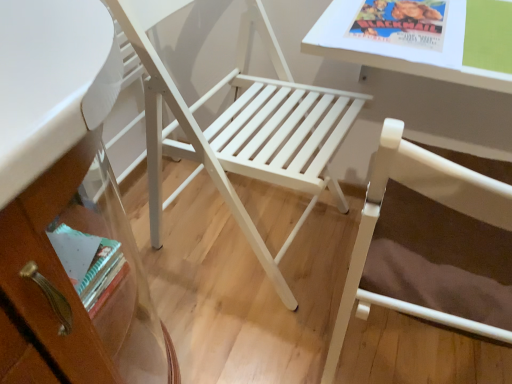
Question: From a real-world perspective, is white wood chair at center, which is the second chair from right to left, positioned under white wood chair at center, which ranks as the 1th chair in right-to-left order, based on gravity?

Choices:
 (A) yes
 (B) no

Answer: (A)

Question: Is white wood chair at center, which is the second chair from right to left, smaller than white wood chair at center, which is counted as the second chair, starting from the left?

Choices:
 (A) yes
 (B) no

Answer: (B)

Question: Is white wood chair at center, which is counted as the second chair, starting from the left, located within white wood chair at center, placed as the first chair when sorted from left to right?

Choices:
 (A) yes
 (B) no

Answer: (B)

Question: Can you confirm if white wood chair at center, placed as the first chair when sorted from left to right, is bigger than white wood chair at center, which ranks as the 1th chair in right-to-left order?

Choices:
 (A) no
 (B) yes

Answer: (B)

Question: Is white wood chair at center, which is the second chair from right to left, oriented away from white wood chair at center, which ranks as the 1th chair in right-to-left order?

Choices:
 (A) yes
 (B) no

Answer: (B)

Question: Considering the positions of point (352, 59) and point (413, 167), is point (352, 59) closer or farther from the camera than point (413, 167)?

Choices:
 (A) farther
 (B) closer

Answer: (A)

Question: Looking at their shapes, would you say white glossy table at upper right is wider or thinner than white wood chair at center, which is counted as the second chair, starting from the left?

Choices:
 (A) thin
 (B) wide

Answer: (A)

Question: In the image, is white glossy table at upper right positioned in front of or behind white wood chair at center, which is counted as the second chair, starting from the left?

Choices:
 (A) behind
 (B) front

Answer: (A)

Question: Is white glossy table at upper right taller or shorter than white wood chair at center, which ranks as the 1th chair in right-to-left order?

Choices:
 (A) tall
 (B) short

Answer: (B)

Question: In terms of height, does white wood chair at center, which is counted as the second chair, starting from the left, look taller or shorter compared to white glossy table at upper right?

Choices:
 (A) tall
 (B) short

Answer: (A)

Question: Is white wood chair at center, which ranks as the 1th chair in right-to-left order, to the left or to the right of white glossy table at upper right in the image?

Choices:
 (A) right
 (B) left

Answer: (B)

Question: In terms of size, does white wood chair at center, which ranks as the 1th chair in right-to-left order, appear bigger or smaller than white glossy table at upper right?

Choices:
 (A) small
 (B) big

Answer: (B)

Question: From a real-world perspective, is white wood chair at center, which is counted as the second chair, starting from the left, above or below white glossy table at upper right?

Choices:
 (A) below
 (B) above

Answer: (A)

Question: From the image's perspective, relative to white wood chair at center, which is the second chair from right to left, is white glossy table at upper right above or below?

Choices:
 (A) above
 (B) below

Answer: (A)

Question: Is white glossy table at upper right to the left or to the right of white wood chair at center, placed as the first chair when sorted from left to right, in the image?

Choices:
 (A) right
 (B) left

Answer: (A)